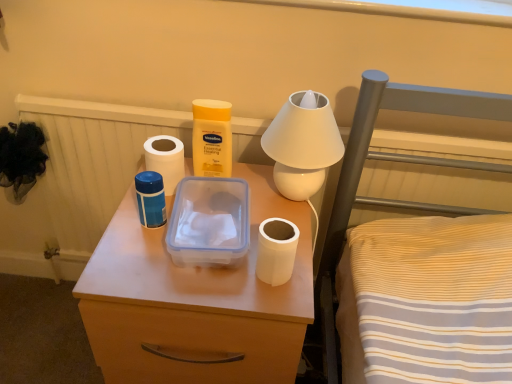
I want to click on vacant space situated on the left part of transparent plastic lunch box at center, so click(x=128, y=245).